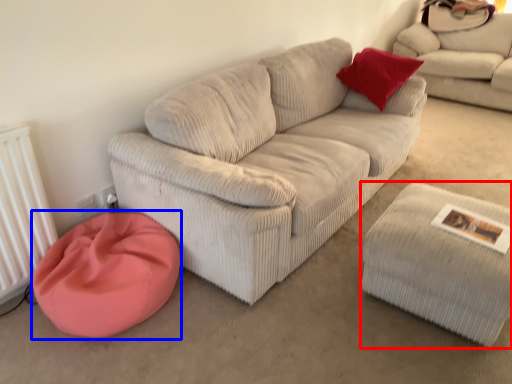
Question: Which of the following is the closest to the observer, stool (highlighted by a red box) or cat bed (highlighted by a blue box)?

Choices:
 (A) stool
 (B) cat bed

Answer: (A)